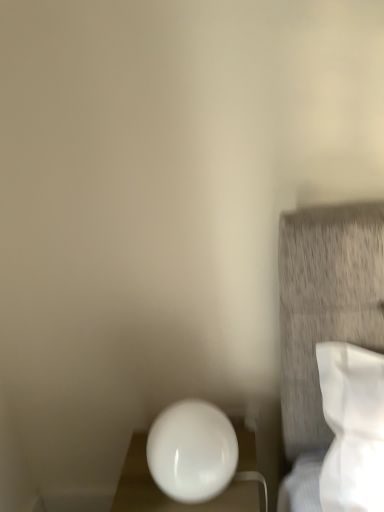
Question: Does white glossy sphere at lower left come in front of white glossy sphere at lower center?

Choices:
 (A) no
 (B) yes

Answer: (B)

Question: Is white glossy sphere at lower left not close to white glossy sphere at lower center?

Choices:
 (A) no
 (B) yes

Answer: (A)

Question: Is white glossy sphere at lower left smaller than white glossy sphere at lower center?

Choices:
 (A) yes
 (B) no

Answer: (A)

Question: Is white glossy sphere at lower left thinner than white glossy sphere at lower center?

Choices:
 (A) no
 (B) yes

Answer: (B)

Question: Can you confirm if white glossy sphere at lower left is positioned to the left of white glossy sphere at lower center?

Choices:
 (A) yes
 (B) no

Answer: (A)

Question: From a real-world perspective, is white glossy sphere at lower left below white glossy sphere at lower center?

Choices:
 (A) yes
 (B) no

Answer: (B)

Question: Is white glossy sphere at lower left located within white glossy sphere at lower center?

Choices:
 (A) no
 (B) yes

Answer: (A)

Question: From the image's perspective, is white glossy sphere at lower center on white glossy sphere at lower left?

Choices:
 (A) yes
 (B) no

Answer: (B)

Question: Is white glossy sphere at lower center to the right of white glossy sphere at lower left from the viewer's perspective?

Choices:
 (A) yes
 (B) no

Answer: (A)

Question: From the image's perspective, is white glossy sphere at lower center beneath white glossy sphere at lower left?

Choices:
 (A) no
 (B) yes

Answer: (B)

Question: From a real-world perspective, is white glossy sphere at lower center over white glossy sphere at lower left?

Choices:
 (A) yes
 (B) no

Answer: (B)

Question: Is white glossy sphere at lower center oriented towards white glossy sphere at lower left?

Choices:
 (A) yes
 (B) no

Answer: (B)

Question: In terms of width, does white glossy sphere at lower left look wider or thinner when compared to white glossy sphere at lower center?

Choices:
 (A) wide
 (B) thin

Answer: (B)